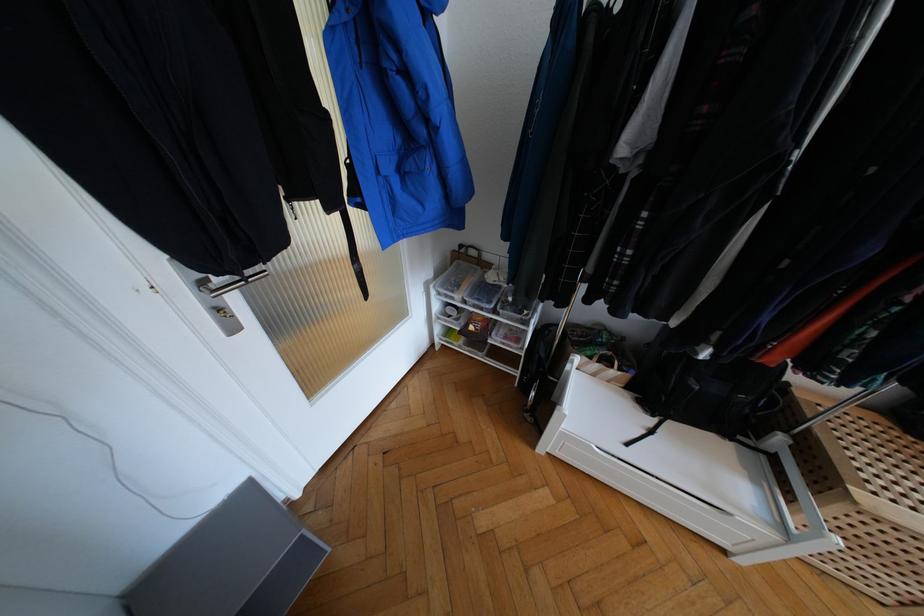
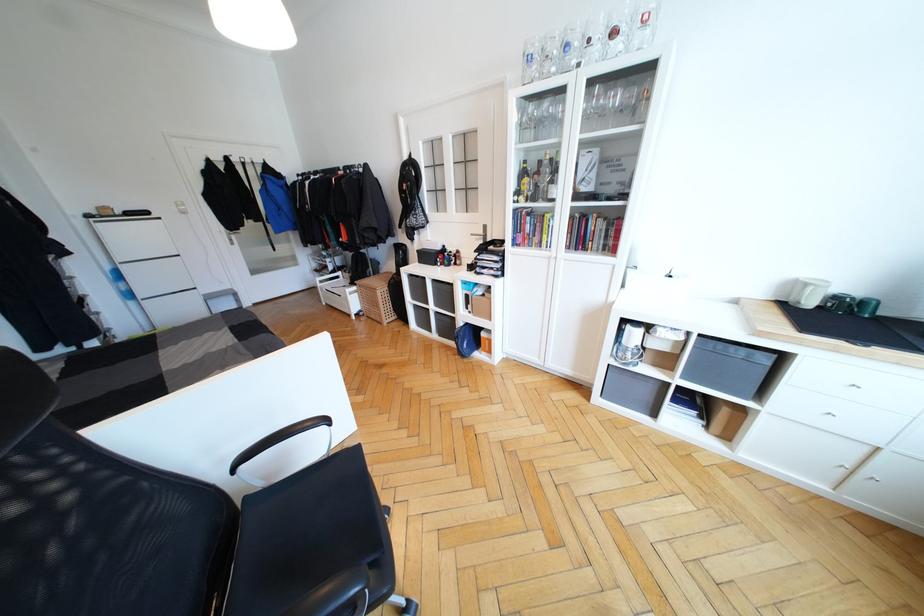
What movement of the cameraman would produce the second image?

The cameraman moved toward right, backward.